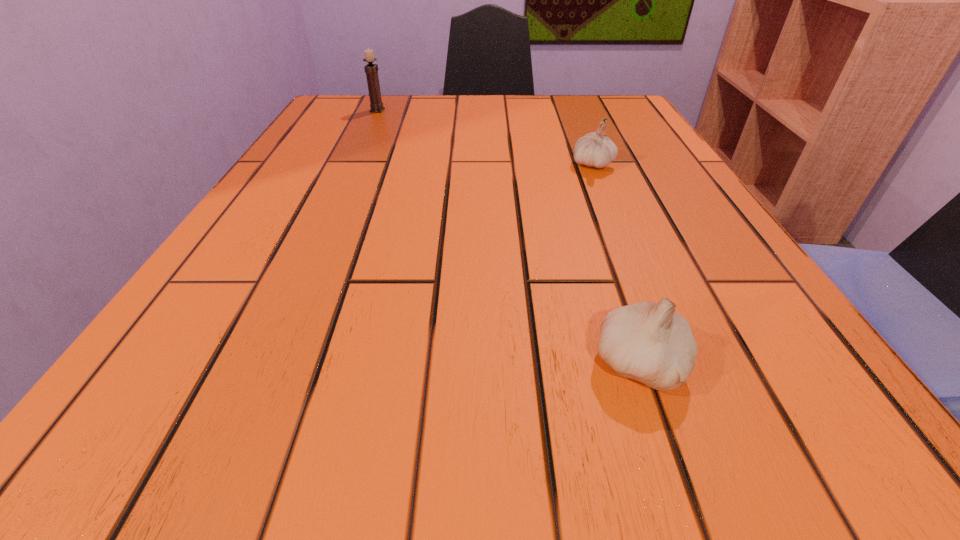
Choose which object is the nearest neighbor to the nearest object. Please provide its 2D coordinates. Your answer should be formatted as a tuple, i.e. [(x, y)], where the tuple contains the x and y coordinates of a point satisfying the conditions above.

[(595, 149)]

Identify which object is the closest to the farther garlic. Please provide its 2D coordinates. Your answer should be formatted as a tuple, i.e. [(x, y)], where the tuple contains the x and y coordinates of a point satisfying the conditions above.

[(651, 343)]

Where is `vacant space that satisfies the following two spatial constraints: 1. on the back side of the nearest object; 2. on the left side of the second farthest object`? This screenshot has height=540, width=960. vacant space that satisfies the following two spatial constraints: 1. on the back side of the nearest object; 2. on the left side of the second farthest object is located at coordinates (571, 164).

Where is `free location that satisfies the following two spatial constraints: 1. on the front side of the second farthest object; 2. on the left side of the leftmost object`? The image size is (960, 540). free location that satisfies the following two spatial constraints: 1. on the front side of the second farthest object; 2. on the left side of the leftmost object is located at coordinates (352, 164).

You are a GUI agent. You are given a task and a screenshot of the screen. Output one action in this format:
    pyautogui.click(x=<x>, y=<y>)
    Task: Click on the free region that satisfies the following two spatial constraints: 1. on the back side of the second farthest object; 2. on the left side of the nearest object
    The width and height of the screenshot is (960, 540).
    Given the screenshot: What is the action you would take?
    pyautogui.click(x=571, y=164)